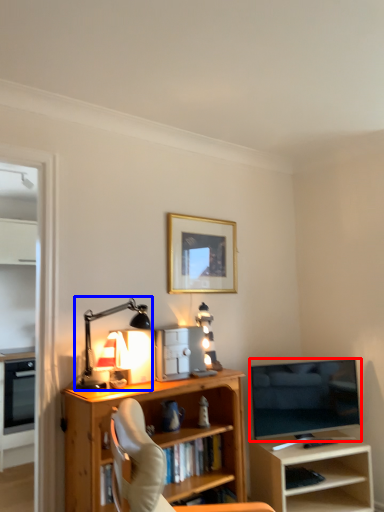
Question: Which object is closer to the camera taking this photo, television (highlighted by a red box) or table lamp (highlighted by a blue box)?

Choices:
 (A) television
 (B) table lamp

Answer: (B)